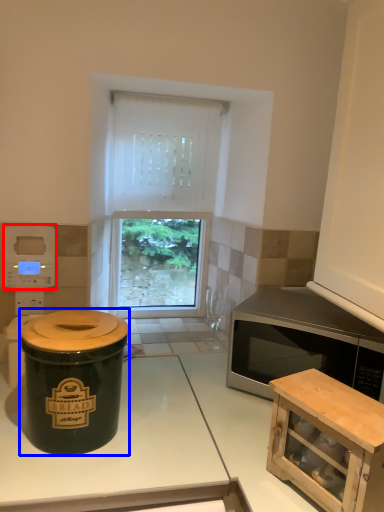
Question: Which point is further to the camera, appliance (highlighted by a red box) or crock pot (highlighted by a blue box)?

Choices:
 (A) appliance
 (B) crock pot

Answer: (A)